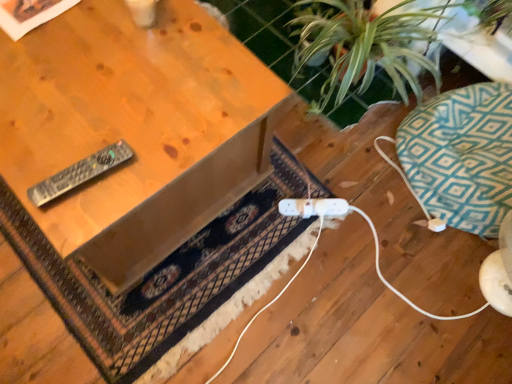
At what (x,y) coordinates should I click in order to perform the action: click on free spot to the right of dark brown woven rug at center. Please return your answer as a coordinate pair (x, y). Looking at the image, I should click on (357, 257).